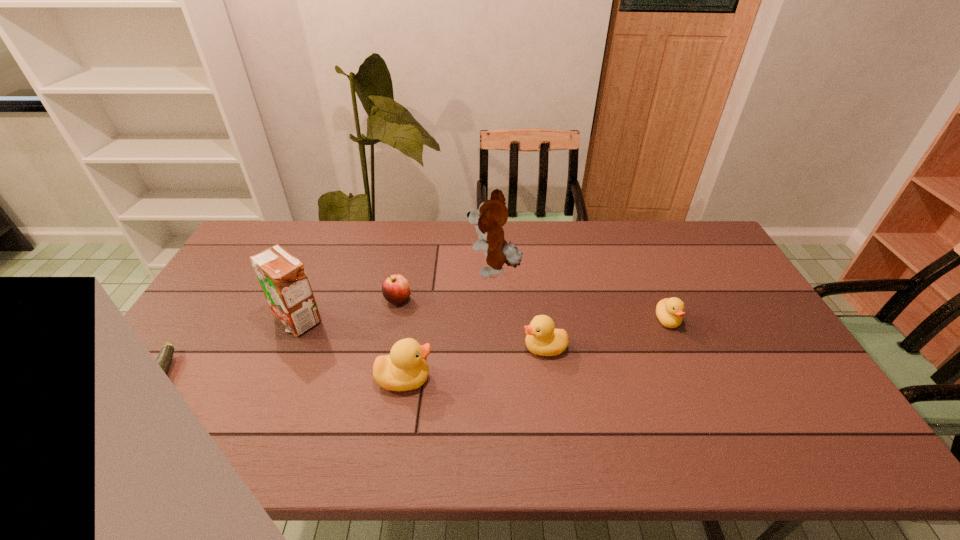
I want to click on apple, so (395, 288).

Image resolution: width=960 pixels, height=540 pixels. Identify the location of the leftmost object. (164, 358).

At what (x,y) coordinates should I click in order to perform the action: click on the shortest object. Please return your answer as a coordinate pair (x, y). This screenshot has width=960, height=540. Looking at the image, I should click on (164, 358).

Locate an element on the screen. free region located 0.200m on the face of the leftmost duckling is located at coordinates (509, 379).

Locate an element on the screen. Image resolution: width=960 pixels, height=540 pixels. blank area located 0.110m on the face of the second tallest duckling is located at coordinates (483, 348).

At what (x,y) coordinates should I click in order to perform the action: click on free space located 0.360m on the face of the second tallest duckling. Please return your answer as a coordinate pair (x, y). The image size is (960, 540). Looking at the image, I should click on (394, 348).

Where is `vacant space positioned on the face of the second tallest duckling`? The height and width of the screenshot is (540, 960). vacant space positioned on the face of the second tallest duckling is located at coordinates (444, 348).

Image resolution: width=960 pixels, height=540 pixels. I want to click on blank space located on the face of the rightmost duckling, so click(x=679, y=346).

Where is `free space located on the straw side of the carton`? The height and width of the screenshot is (540, 960). free space located on the straw side of the carton is located at coordinates coord(271,383).

Locate an element on the screen. The height and width of the screenshot is (540, 960). blank space located 0.070m on the face of the puppy is located at coordinates (447, 271).